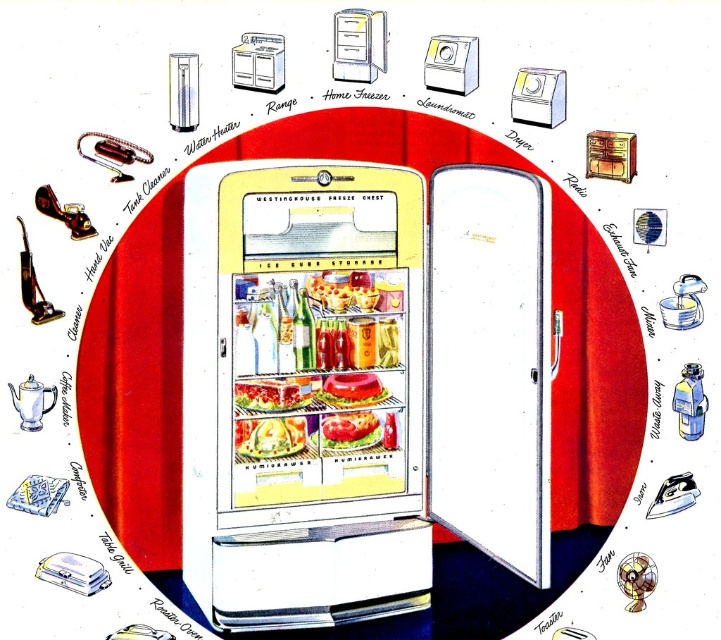
Question: Which of the following is the closest to the observer?

Choices:
 (A) (358, 419)
 (B) (9, 394)

Answer: (B)

Question: Can you confirm if metallic silver range at upper left is thinner than shiny plastic sandwich at center?

Choices:
 (A) yes
 (B) no

Answer: (A)

Question: Does matte white dryer at upper right come behind metallic silver water heater at upper left?

Choices:
 (A) yes
 (B) no

Answer: (A)

Question: Among these objects, which one is nearest to the camera?

Choices:
 (A) translucent plastic salad bowl at center
 (B) matte yellow refrigerator at center

Answer: (B)

Question: Does matte white washing machine at upper center appear under translucent plastic salad bowl at center?

Choices:
 (A) no
 (B) yes

Answer: (A)

Question: Estimate the real-world distances between objects in this image. Which object is farther from the matte white dryer at upper right?

Choices:
 (A) matte yellow refrigerator at center
 (B) matte white washing machine at upper center
 (C) translucent plastic container at center
 (D) translucent plastic salad bowl at center

Answer: (D)